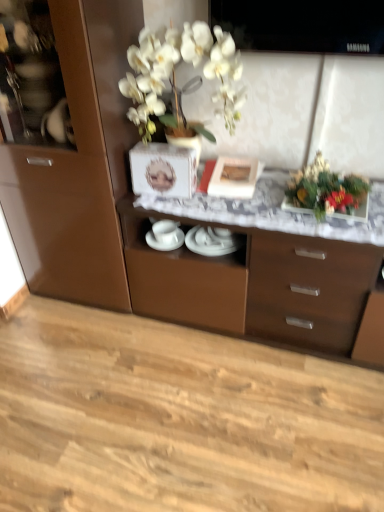
What is the approximate height of white glossy plates at center, which appears as the 1th tableware when viewed from the right?

The height of white glossy plates at center, which appears as the 1th tableware when viewed from the right, is 0.69 inches.

In order to face brown glossy cabinet at center, should I rotate leftwards or rightwards?

It's best to rotate right around 9.653 degrees.

You are a GUI agent. You are given a task and a screenshot of the screen. Output one action in this format:
    pyautogui.click(x=<x>, y=<y>)
    Task: Click on the matte white picture frame at center
    This screenshot has width=384, height=512.
    Given the screenshot: What is the action you would take?
    pyautogui.click(x=234, y=177)

Describe the element at coordinates (326, 192) in the screenshot. I see `shiny metallic vase at upper right` at that location.

Where is `white glossy plates at center, which appears as the 1th tableware when viewed from the right`? This screenshot has width=384, height=512. white glossy plates at center, which appears as the 1th tableware when viewed from the right is located at coordinates (213, 241).

From their relative heights in the image, would you say white glossy plates at center, which appears as the 1th tableware when viewed from the right, is taller or shorter than shiny metallic vase at upper right?

Clearly, white glossy plates at center, which appears as the 1th tableware when viewed from the right, is shorter compared to shiny metallic vase at upper right.

Choose the correct answer: Is white glossy plates at center, which appears as the 1th tableware when viewed from the right, inside shiny metallic vase at upper right or outside it?

white glossy plates at center, which appears as the 1th tableware when viewed from the right, exists outside the volume of shiny metallic vase at upper right.

From the image's perspective, which one is positioned higher, white glossy plates at center, positioned as the second tableware in left-to-right order, or shiny metallic vase at upper right?

shiny metallic vase at upper right, from the image's perspective.

Can you confirm if matte white picture frame at center is shorter than natural wood floor at lower center?

In fact, matte white picture frame at center may be taller than natural wood floor at lower center.

How many degrees apart are the facing directions of matte white picture frame at center and natural wood floor at lower center?

There is a 172-degree angle between the facing directions of matte white picture frame at center and natural wood floor at lower center.

Does matte white picture frame at center lie in front of natural wood floor at lower center?

Answer: No, it is behind natural wood floor at lower center.

Based on the photo, is matte white picture frame at center bigger than natural wood floor at lower center?

Actually, matte white picture frame at center might be smaller than natural wood floor at lower center.

In the scene shown: Which of these two, shiny metallic vase at upper right or matte white picture frame at center, is bigger?

shiny metallic vase at upper right is bigger.

Is shiny metallic vase at upper right far from matte white picture frame at center?

No, shiny metallic vase at upper right is not far from matte white picture frame at center.

How distant is shiny metallic vase at upper right from matte white picture frame at center?

The distance of shiny metallic vase at upper right from matte white picture frame at center is 8.98 inches.

Which object is further away from the camera, shiny metallic vase at upper right or matte white picture frame at center?

matte white picture frame at center is further from the camera.

Does white glossy plates at center, acting as the 1th tableware starting from the left, come behind matte white picture frame at center?

Yes.

Image resolution: width=384 pixels, height=512 pixels. In order to click on picture frame in front of the white glossy plates at center, acting as the 1th tableware starting from the left in this screenshot , I will do `click(234, 177)`.

Which is in front, point (171, 225) or point (214, 174)?

The point (171, 225) is in front.

Does shiny metallic vase at upper right appear on the left side of white glossy plates at center, which appears as the 1th tableware when viewed from the right?

No.

Considering the relative sizes of shiny metallic vase at upper right and white glossy plates at center, positioned as the second tableware in left-to-right order, in the image provided, is shiny metallic vase at upper right taller than white glossy plates at center, positioned as the second tableware in left-to-right order,?

Yes, shiny metallic vase at upper right is taller than white glossy plates at center, positioned as the second tableware in left-to-right order.

Is shiny metallic vase at upper right touching white glossy plates at center, positioned as the second tableware in left-to-right order?

shiny metallic vase at upper right and white glossy plates at center, positioned as the second tableware in left-to-right order, are not in contact.

Looking at their sizes, would you say shiny metallic vase at upper right is wider or thinner than white glossy plates at center, positioned as the second tableware in left-to-right order?

In the image, shiny metallic vase at upper right appears to be wider than white glossy plates at center, positioned as the second tableware in left-to-right order.

Is shiny metallic vase at upper right taller or shorter than white glossy plates at center, the 2th tableware from the right?

shiny metallic vase at upper right is taller than white glossy plates at center, the 2th tableware from the right.

From a real-world perspective, which object stands above the other?

shiny metallic vase at upper right.

Can you see shiny metallic vase at upper right touching white glossy plates at center, acting as the 1th tableware starting from the left?

There is a gap between shiny metallic vase at upper right and white glossy plates at center, acting as the 1th tableware starting from the left.

Is white glossy plates at center, which appears as the 1th tableware when viewed from the right, completely or partially outside of matte white picture frame at center?

Yes, white glossy plates at center, which appears as the 1th tableware when viewed from the right, is located beyond the bounds of matte white picture frame at center.

From the image's perspective, does white glossy plates at center, which appears as the 1th tableware when viewed from the right, appear higher than matte white picture frame at center?

No, from the image's perspective, white glossy plates at center, which appears as the 1th tableware when viewed from the right, is not on top of matte white picture frame at center.

Could you tell me if white glossy plates at center, positioned as the second tableware in left-to-right order, is turned towards matte white picture frame at center?

No, white glossy plates at center, positioned as the second tableware in left-to-right order, is not turned towards matte white picture frame at center.

Which object is closer to the camera, white glossy plates at center, positioned as the second tableware in left-to-right order, or matte white picture frame at center?

matte white picture frame at center is more forward.

Where is `tableware that is the 2nd one when counting downward from the shiny metallic vase at upper right (from the image's perspective)`? tableware that is the 2nd one when counting downward from the shiny metallic vase at upper right (from the image's perspective) is located at coordinates (213, 241).

Where is `hardwood below the matte white picture frame at center (from a real-world perspective)`? hardwood below the matte white picture frame at center (from a real-world perspective) is located at coordinates (178, 419).

From the picture: Looking at the image, which one is located closer to white glossy plates at center, positioned as the second tableware in left-to-right order, shiny metallic vase at upper right or white glossy plates at center, acting as the 1th tableware starting from the left?

white glossy plates at center, acting as the 1th tableware starting from the left.

Based on their spatial positions, is white glossy plates at center, positioned as the second tableware in left-to-right order, or brown glossy cabinet at center closer to white glossy plates at center, acting as the 1th tableware starting from the left?

The object closer to white glossy plates at center, acting as the 1th tableware starting from the left, is white glossy plates at center, positioned as the second tableware in left-to-right order.

Based on their spatial positions, is brown glossy cabinet at center or white glossy plates at center, which appears as the 1th tableware when viewed from the right, closer to matte white picture frame at center?

The object closer to matte white picture frame at center is white glossy plates at center, which appears as the 1th tableware when viewed from the right.

Based on their spatial positions, is shiny metallic vase at upper right or white glossy plates at center, acting as the 1th tableware starting from the left, closer to brown glossy cabinet at center?

The object closer to brown glossy cabinet at center is shiny metallic vase at upper right.

Estimate the real-world distances between objects in this image. Which object is further from natural wood floor at lower center, shiny metallic vase at upper right or white glossy plates at center, which appears as the 1th tableware when viewed from the right?

shiny metallic vase at upper right is positioned further to the anchor natural wood floor at lower center.

Estimate the real-world distances between objects in this image. Which object is further from shiny metallic vase at upper right, white glossy plates at center, the 2th tableware from the right, or matte white picture frame at center?

white glossy plates at center, the 2th tableware from the right, lies further to shiny metallic vase at upper right than the other object.

Looking at the image, which one is located further to white glossy plates at center, the 2th tableware from the right, matte white picture frame at center or brown glossy cabinet at center?

Based on the image, brown glossy cabinet at center appears to be further to white glossy plates at center, the 2th tableware from the right.

Estimate the real-world distances between objects in this image. Which object is further from matte white picture frame at center, white glossy plates at center, which appears as the 1th tableware when viewed from the right, or white glossy plates at center, the 2th tableware from the right?

white glossy plates at center, the 2th tableware from the right, is further to matte white picture frame at center.

Locate an element on the screen. The width and height of the screenshot is (384, 512). desk between white glossy plates at center, positioned as the second tableware in left-to-right order, and shiny metallic vase at upper right is located at coordinates (259, 279).

This screenshot has height=512, width=384. Identify the location of picture frame located between white glossy plates at center, which appears as the 1th tableware when viewed from the right, and shiny metallic vase at upper right in the left-right direction. (234, 177).

The width and height of the screenshot is (384, 512). Identify the location of tableware between matte white picture frame at center and white glossy plates at center, which appears as the 1th tableware when viewed from the right, from top to bottom. (165, 236).

Where is `picture frame between brown glossy cabinet at center and white glossy plates at center, the 2th tableware from the right, along the z-axis`? picture frame between brown glossy cabinet at center and white glossy plates at center, the 2th tableware from the right, along the z-axis is located at coordinates point(234,177).